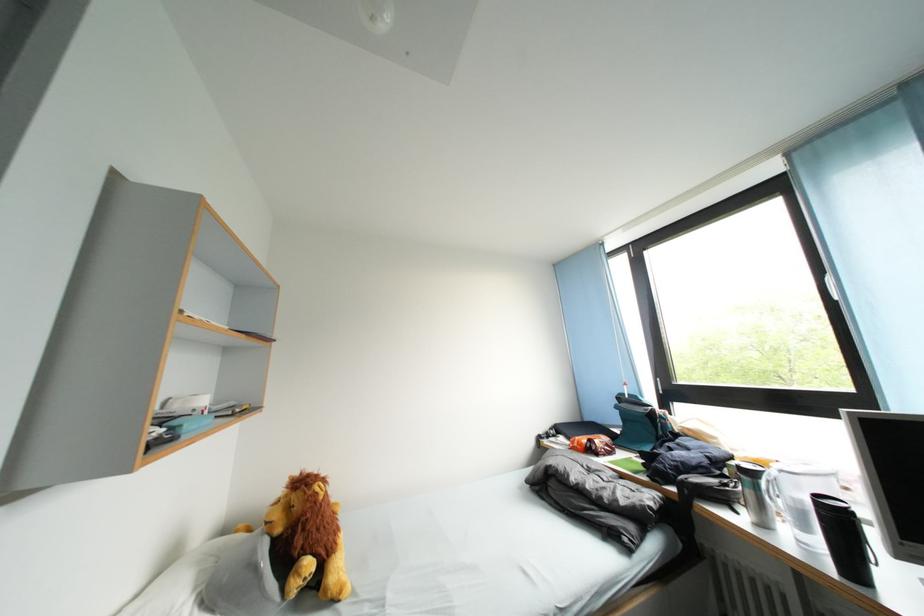
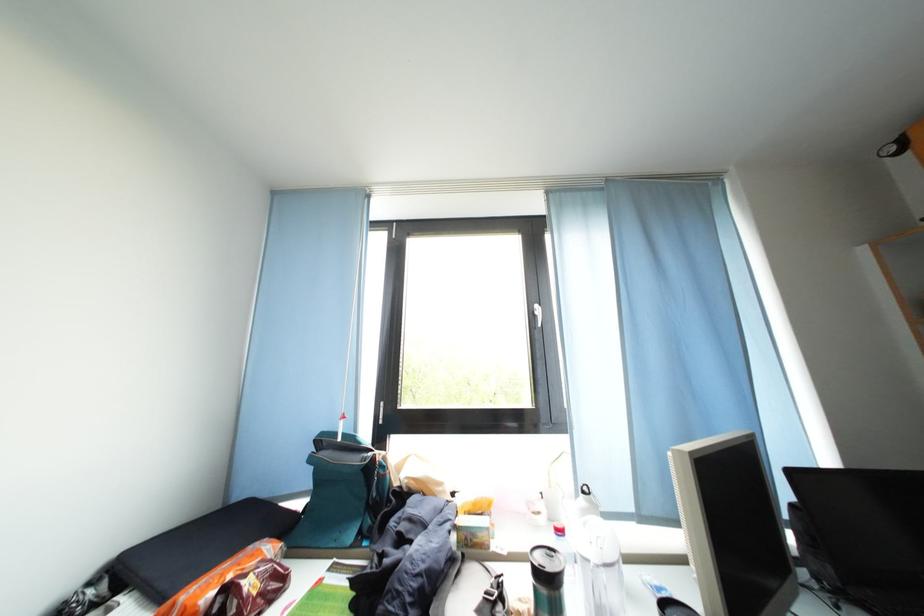
Find the pixel in the second image that matches point 759,479 in the first image.

(568, 589)